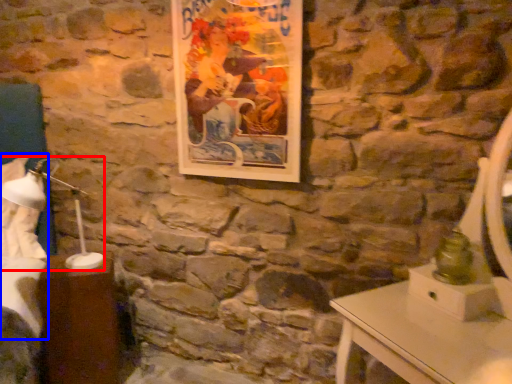
Question: Which of the following is the closest to the observer, bedside lamp (highlighted by a red box) or sheet (highlighted by a blue box)?

Choices:
 (A) bedside lamp
 (B) sheet

Answer: (A)